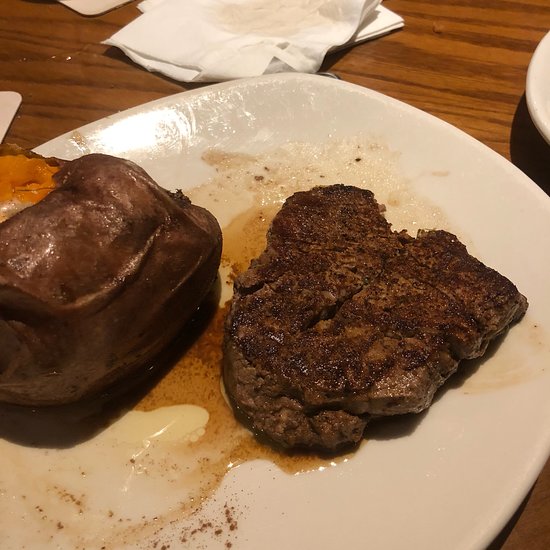
Where is `napkin`? This screenshot has height=550, width=550. napkin is located at coordinates (218, 51).